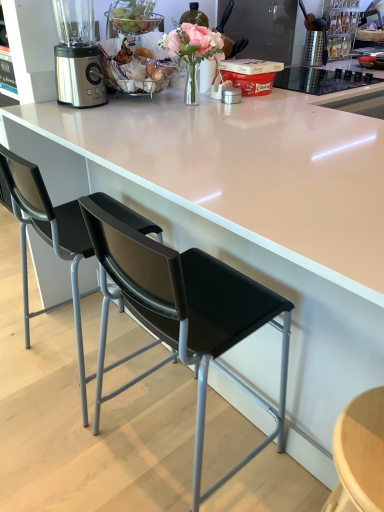
Question: Is satin silver blender at upper left at the right side of black plastic chair at left, arranged as the 2th chair when viewed from the right?

Choices:
 (A) yes
 (B) no

Answer: (B)

Question: Is the depth of satin silver blender at upper left less than that of black plastic chair at left, acting as the first chair starting from the left?

Choices:
 (A) no
 (B) yes

Answer: (A)

Question: Does satin silver blender at upper left turn towards black plastic chair at left, acting as the first chair starting from the left?

Choices:
 (A) yes
 (B) no

Answer: (B)

Question: Does satin silver blender at upper left have a greater width compared to black plastic chair at left, arranged as the 2th chair when viewed from the right?

Choices:
 (A) yes
 (B) no

Answer: (B)

Question: Are satin silver blender at upper left and black plastic chair at left, arranged as the 2th chair when viewed from the right, far apart?

Choices:
 (A) no
 (B) yes

Answer: (A)

Question: Can you confirm if satin silver blender at upper left is bigger than black plastic chair at left, arranged as the 2th chair when viewed from the right?

Choices:
 (A) yes
 (B) no

Answer: (B)

Question: Can you confirm if black leather chair at center, the 1th chair from the right, is positioned to the left of satin silver blender at upper left?

Choices:
 (A) no
 (B) yes

Answer: (A)

Question: Could you tell me if black leather chair at center, which is counted as the 2th chair, starting from the left, is turned towards satin silver blender at upper left?

Choices:
 (A) no
 (B) yes

Answer: (A)

Question: Is black leather chair at center, the 1th chair from the right, not inside satin silver blender at upper left?

Choices:
 (A) no
 (B) yes

Answer: (B)

Question: Does black leather chair at center, which is counted as the 2th chair, starting from the left, lie in front of satin silver blender at upper left?

Choices:
 (A) no
 (B) yes

Answer: (B)

Question: From a real-world perspective, is black leather chair at center, the 1th chair from the right, under satin silver blender at upper left?

Choices:
 (A) no
 (B) yes

Answer: (B)

Question: Can you confirm if black leather chair at center, which is counted as the 2th chair, starting from the left, is thinner than satin silver blender at upper left?

Choices:
 (A) no
 (B) yes

Answer: (A)

Question: Would you consider black plastic chair at left, arranged as the 2th chair when viewed from the right, to be distant from black leather chair at center, the 1th chair from the right?

Choices:
 (A) yes
 (B) no

Answer: (B)